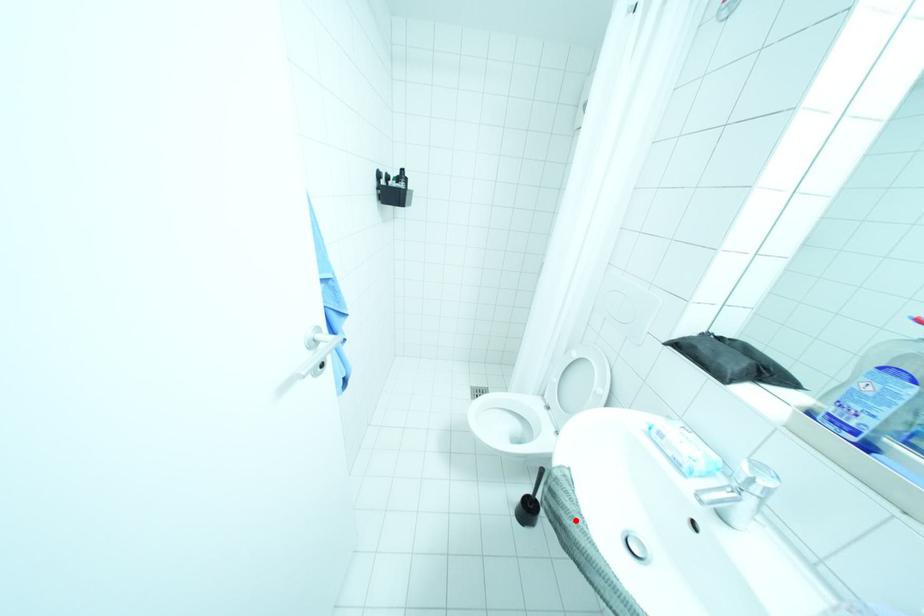
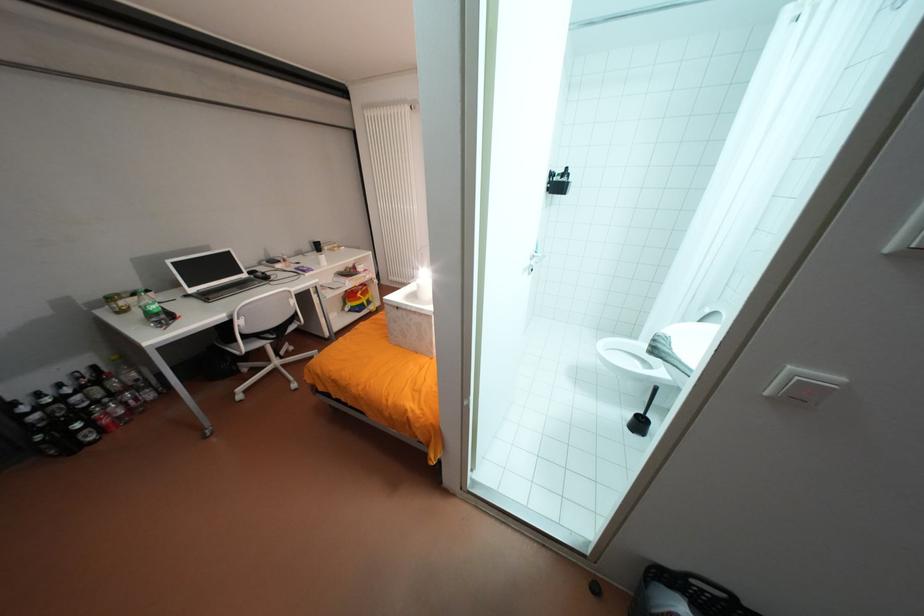
Question: I am providing you with two images of the same scene from different viewpoints. A red point is shown in image1. For the corresponding object point in image2, is it positioned nearer or farther from the camera?

Choices:
 (A) Nearer
 (B) Farther

Answer: (A)